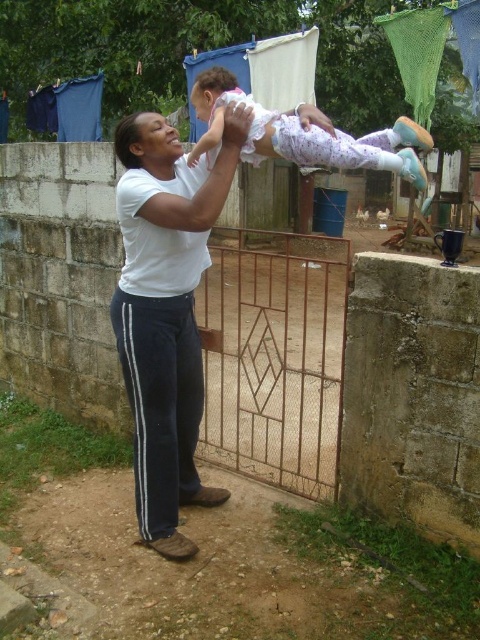
Is point (320, 461) positioned behind point (218, 68)?

Yes, point (320, 461) is farther from viewer.

Between rusty metal gate at center and white cotton baby at upper center, which one is positioned higher?

white cotton baby at upper center is higher up.

Where is `rusty metal gate at center`? rusty metal gate at center is located at coordinates pos(274,356).

You are a GUI agent. You are given a task and a screenshot of the screen. Output one action in this format:
    pyautogui.click(x=<x>, y=<y>)
    Task: Click on the rusty metal gate at center
    This screenshot has height=640, width=480.
    Given the screenshot: What is the action you would take?
    pyautogui.click(x=274, y=356)

Can you confirm if white cotton shirt at center is bigger than white cotton baby at upper center?

Yes.

Does white cotton shirt at center have a greater width compared to white cotton baby at upper center?

Incorrect, white cotton shirt at center's width does not surpass white cotton baby at upper center's.

Between point (249, 124) and point (287, 157), which one is positioned in front?

Positioned in front is point (249, 124).

Identify the location of white cotton shirt at center. Image resolution: width=480 pixels, height=640 pixels. (166, 312).

Looking at this image, how much distance is there between rusty metal gate at center and white cotton shirt at center?

1.11 meters

Which is in front, point (213, 273) or point (145, 269)?

Positioned in front is point (145, 269).

This screenshot has height=640, width=480. Find the location of `rusty metal gate at center`. rusty metal gate at center is located at coordinates (274, 356).

Image resolution: width=480 pixels, height=640 pixels. In order to click on rusty metal gate at center in this screenshot , I will do `click(274, 356)`.